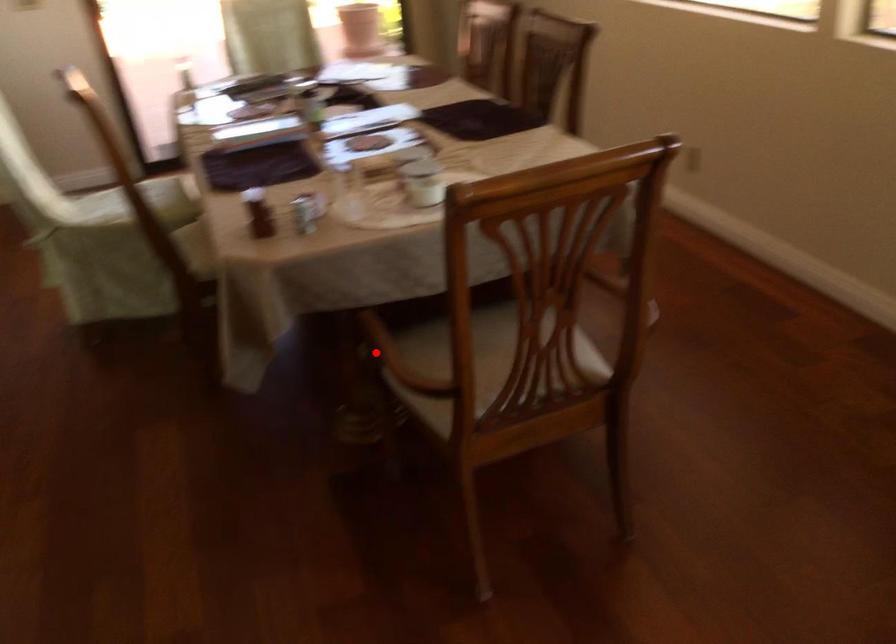
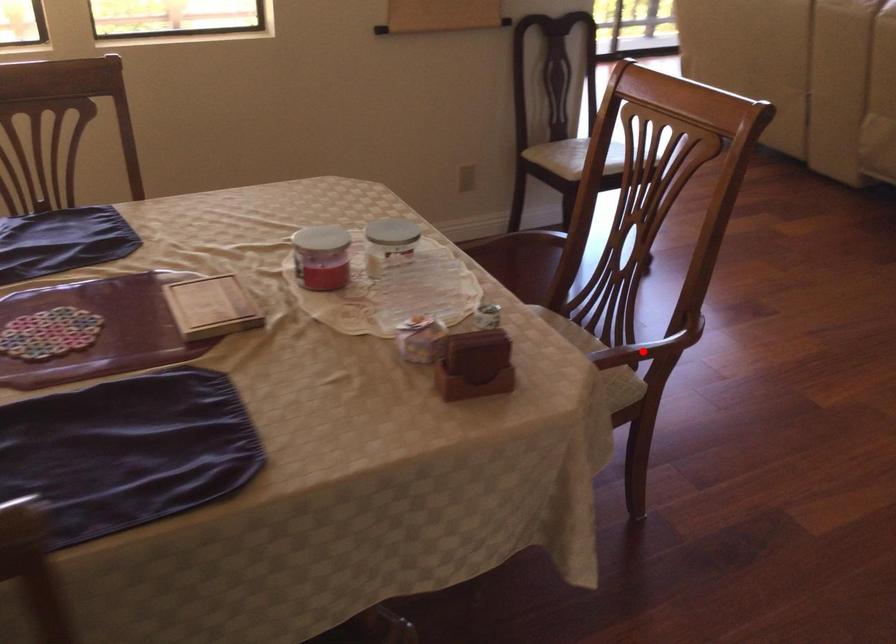
I am providing you with two images of the same scene from different viewpoints. A red point is marked on the first image and another point is marked on the second image. Are the points marked in image1 and image2 representing the same 3D position?

Yes